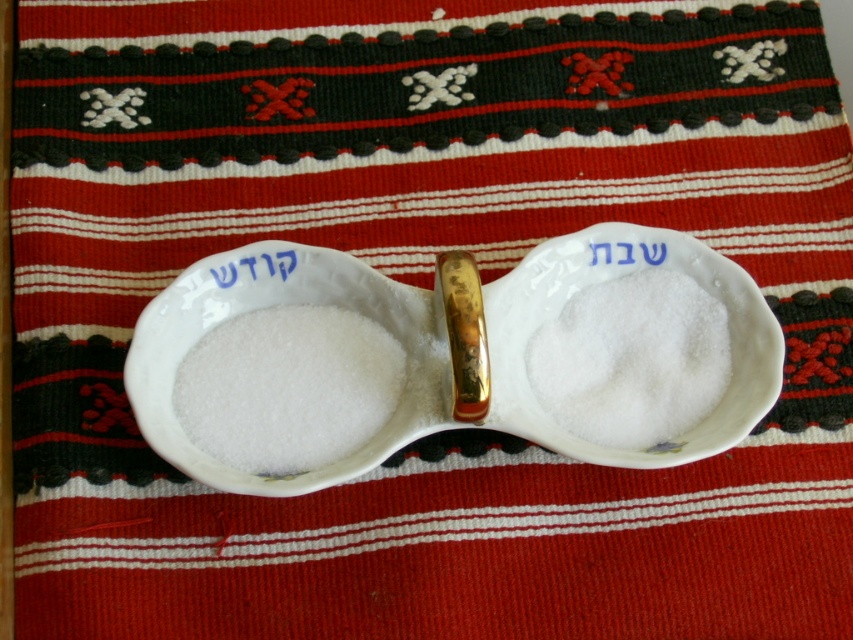
Is white ceramic text at center shorter than white paper at center?

Incorrect, white ceramic text at center's height does not fall short of white paper at center's.

Who is lower down, white ceramic text at center or white paper at center?

white ceramic text at center is below.

Find the location of a particular element. The height and width of the screenshot is (640, 853). white ceramic text at center is located at coordinates (254, 268).

Does white powder at center come behind white paper at center?

No, white powder at center is closer to the viewer.

Does point (556, 385) come behind point (624, 243)?

No, (556, 385) is in front of (624, 243).

Where is `white powder at center`? white powder at center is located at coordinates (631, 358).

Does point (193, 442) come in front of point (659, 253)?

Yes.

Does white powdery flour at center have a greater width compared to white paper at center?

Yes.

What do you see at coordinates (288, 387) in the screenshot? The height and width of the screenshot is (640, 853). I see `white powdery flour at center` at bounding box center [288, 387].

You are a GUI agent. You are given a task and a screenshot of the screen. Output one action in this format:
    pyautogui.click(x=<x>, y=<y>)
    Task: Click on the white powdery flour at center
    The height and width of the screenshot is (640, 853).
    Given the screenshot: What is the action you would take?
    pyautogui.click(x=288, y=387)